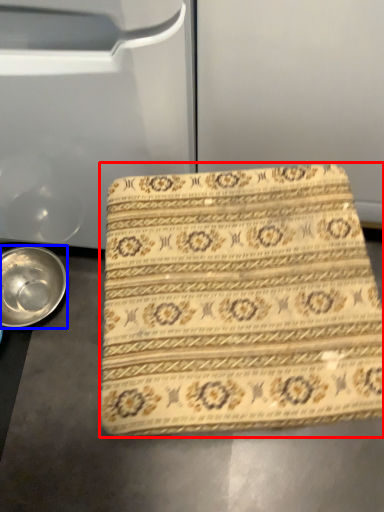
Question: Which object appears closest to the camera in this image, beach towel (highlighted by a red box) or bowl (highlighted by a blue box)?

Choices:
 (A) beach towel
 (B) bowl

Answer: (A)